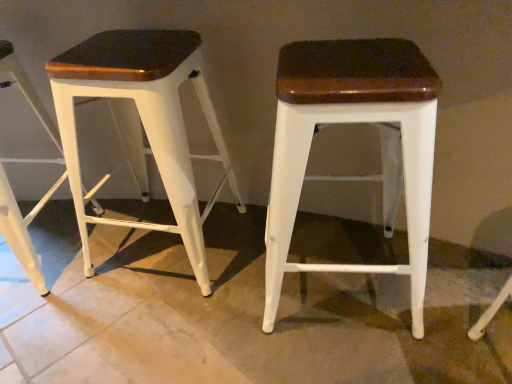
Question: Does matte white stool at left, which is counted as the 2th stool, starting from the left, appear on the right side of matte white stool at left, which is the 1th stool from left to right?

Choices:
 (A) no
 (B) yes

Answer: (B)

Question: From a real-world perspective, is matte white stool at left, which is the second stool from right to left, under matte white stool at left, marked as the third stool in a right-to-left arrangement?

Choices:
 (A) yes
 (B) no

Answer: (B)

Question: Is matte white stool at left, which is the second stool from right to left, oriented towards matte white stool at left, marked as the third stool in a right-to-left arrangement?

Choices:
 (A) no
 (B) yes

Answer: (A)

Question: Can you confirm if matte white stool at left, which is the second stool from right to left, is thinner than matte white stool at left, marked as the third stool in a right-to-left arrangement?

Choices:
 (A) no
 (B) yes

Answer: (B)

Question: Is matte white stool at left, which is counted as the 2th stool, starting from the left, completely or partially outside of matte white stool at left, marked as the third stool in a right-to-left arrangement?

Choices:
 (A) no
 (B) yes

Answer: (B)

Question: Looking at their shapes, would you say matte white stool at left, which is counted as the 2th stool, starting from the left, is wider or thinner than matte white stool at center, positioned as the first stool in right-to-left order?

Choices:
 (A) thin
 (B) wide

Answer: (A)

Question: From the image's perspective, relative to matte white stool at center, the third stool when ordered from left to right, is matte white stool at left, which is the second stool from right to left, above or below?

Choices:
 (A) above
 (B) below

Answer: (A)

Question: Is matte white stool at left, which is the second stool from right to left, bigger or smaller than matte white stool at center, the third stool when ordered from left to right?

Choices:
 (A) small
 (B) big

Answer: (A)

Question: In terms of height, does matte white stool at left, which is counted as the 2th stool, starting from the left, look taller or shorter compared to matte white stool at center, positioned as the first stool in right-to-left order?

Choices:
 (A) tall
 (B) short

Answer: (A)

Question: From the image's perspective, is matte white stool at center, the third stool when ordered from left to right, positioned above or below matte white stool at left, which is the 1th stool from left to right?

Choices:
 (A) below
 (B) above

Answer: (A)

Question: Would you say matte white stool at center, positioned as the first stool in right-to-left order, is to the left or to the right of matte white stool at left, which is the 1th stool from left to right, in the picture?

Choices:
 (A) right
 (B) left

Answer: (A)

Question: Considering the positions of matte white stool at center, positioned as the first stool in right-to-left order, and matte white stool at left, marked as the third stool in a right-to-left arrangement, in the image, is matte white stool at center, positioned as the first stool in right-to-left order, taller or shorter than matte white stool at left, marked as the third stool in a right-to-left arrangement,?

Choices:
 (A) short
 (B) tall

Answer: (A)

Question: Is matte white stool at center, positioned as the first stool in right-to-left order, in front of or behind matte white stool at left, marked as the third stool in a right-to-left arrangement, in the image?

Choices:
 (A) behind
 (B) front

Answer: (B)

Question: Considering the positions of matte white stool at center, positioned as the first stool in right-to-left order, and matte white stool at left, which is the second stool from right to left, in the image, is matte white stool at center, positioned as the first stool in right-to-left order, taller or shorter than matte white stool at left, which is the second stool from right to left,?

Choices:
 (A) short
 (B) tall

Answer: (A)

Question: Based on their sizes in the image, would you say matte white stool at center, positioned as the first stool in right-to-left order, is bigger or smaller than matte white stool at left, which is the second stool from right to left?

Choices:
 (A) small
 (B) big

Answer: (B)